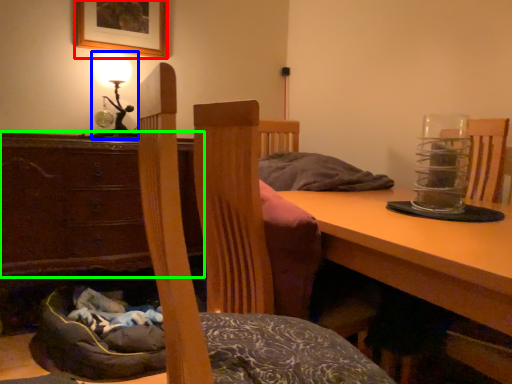
Question: Considering the real-world distances, which object is farthest from picture frame (highlighted by a red box)? table lamp (highlighted by a blue box) or cabinetry (highlighted by a green box)?

Choices:
 (A) table lamp
 (B) cabinetry

Answer: (B)